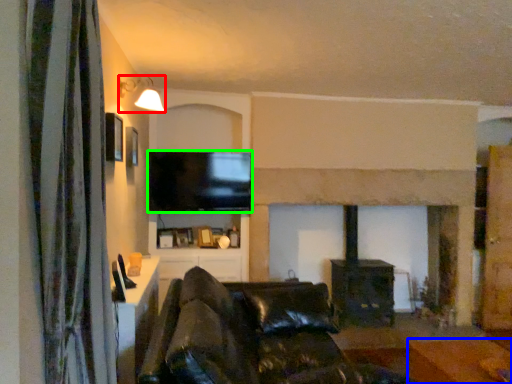
Question: Considering the real-world distances, which object is farthest from light fixture (highlighted by a red box)? furniture (highlighted by a blue box) or television (highlighted by a green box)?

Choices:
 (A) furniture
 (B) television

Answer: (A)